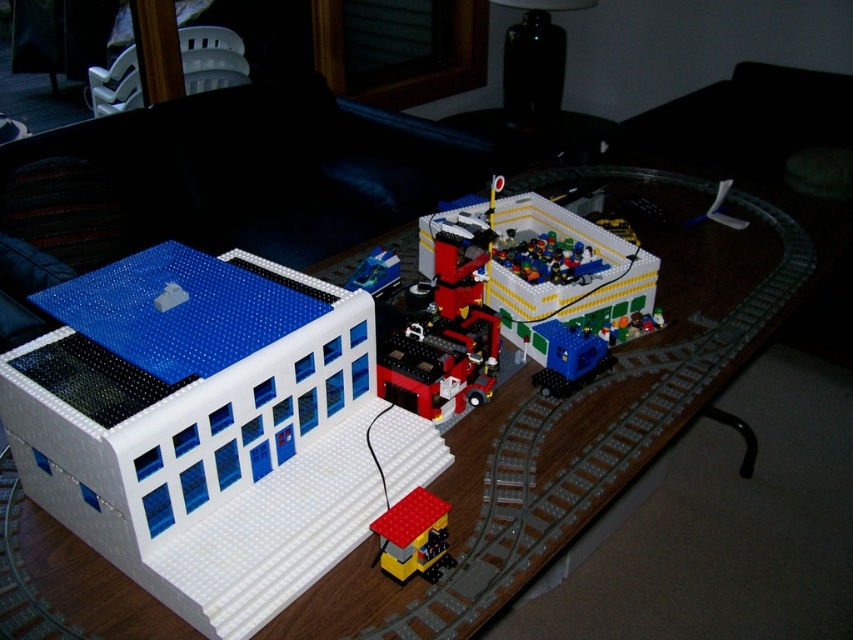
You are trying to place a new LEGO structure that requires the same width as the white matte building at left. If the wooden table at center can only accommodate items up to its own width, will the new structure fit on the table?

The white matte building at left has a width less than the wooden table at center, so the new structure with the same width as the white matte building at left will fit on the table.

You are a LEGO enthusiast trying to determine if your new brick red plastic train at lower center will fit inside the white matte building at left. Based on the scene description, can you confirm if the train will fit inside the building?

The white matte building at left has a larger size compared to the brick red plastic train at lower center, so the train should fit inside the building.